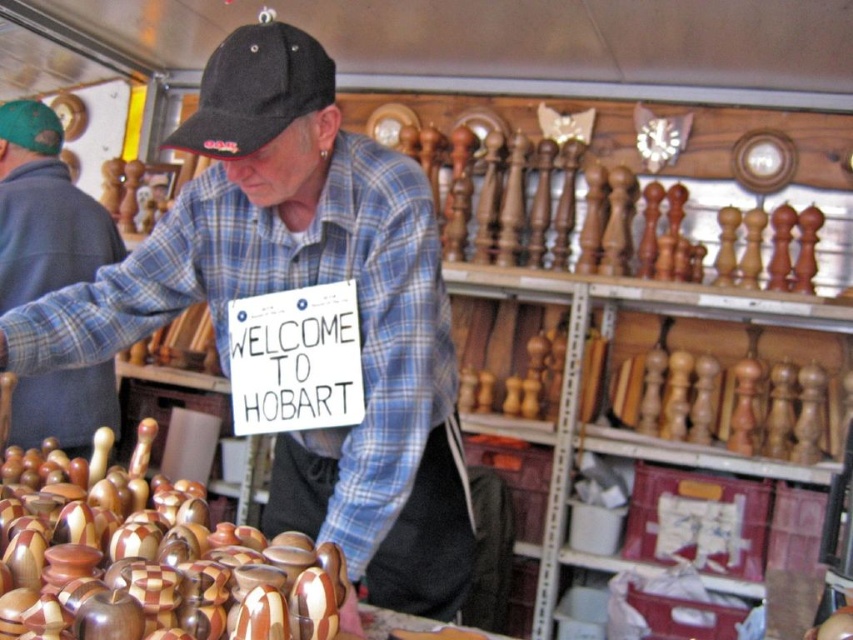
You are a customer at the market stall and want to know which item is shorter between the blue plaid shirt at center and the matte black cap at upper left. Can you tell me?

The blue plaid shirt at center has a lesser height compared to matte black cap at upper left, so the blue plaid shirt at center is shorter.